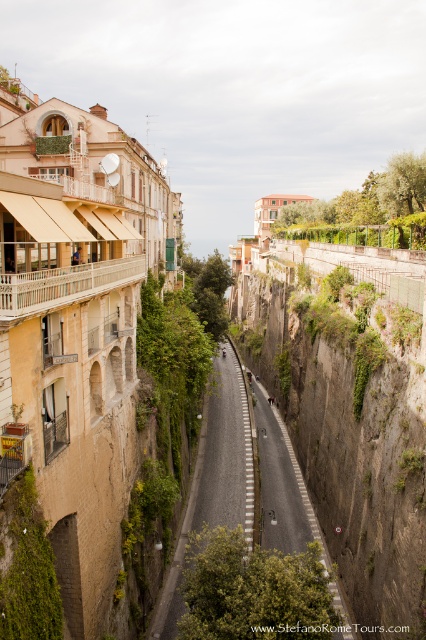
Question: Does brown rough cliff at center come in front of asphalt road at center?

Choices:
 (A) yes
 (B) no

Answer: (A)

Question: Is brown rough cliff at center below asphalt road at center?

Choices:
 (A) no
 (B) yes

Answer: (A)

Question: Is brown rough cliff at center wider than asphalt road at center?

Choices:
 (A) yes
 (B) no

Answer: (A)

Question: Which point is closer to the camera taking this photo?

Choices:
 (A) (161, 616)
 (B) (374, 436)

Answer: (A)

Question: Which of the following is the closest to the observer?

Choices:
 (A) asphalt road at center
 (B) brown rough cliff at center

Answer: (B)

Question: Which object appears farthest from the camera in this image?

Choices:
 (A) brown rough cliff at center
 (B) asphalt road at center

Answer: (B)